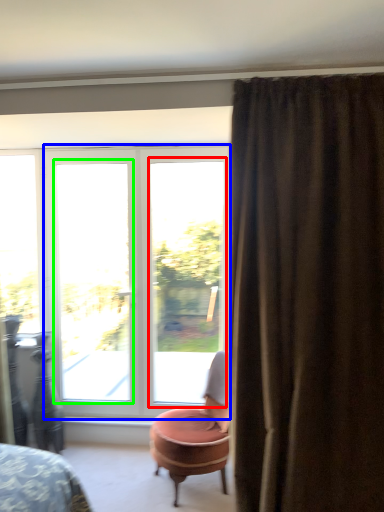
Question: Which object is positioned farthest from window (highlighted by a red box)? Select from door (highlighted by a blue box) and window (highlighted by a green box).

Choices:
 (A) door
 (B) window

Answer: (B)